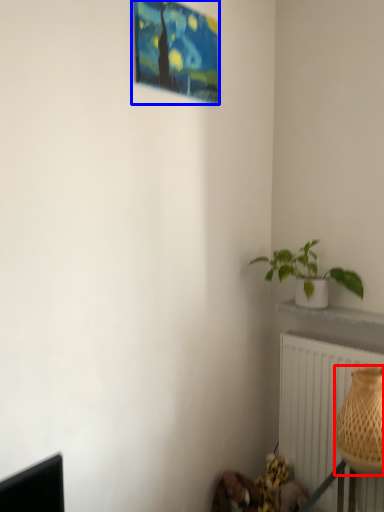
Question: Which object is further to the camera taking this photo, basket (highlighted by a red box) or picture frame (highlighted by a blue box)?

Choices:
 (A) basket
 (B) picture frame

Answer: (A)